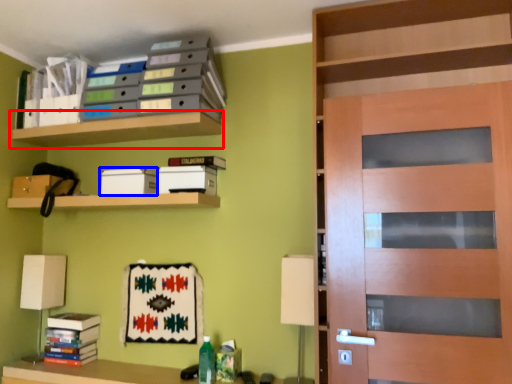
Question: Among these objects, which one is nearest to the camera, shelf (highlighted by a red box) or storage box (highlighted by a blue box)?

Choices:
 (A) shelf
 (B) storage box

Answer: (A)